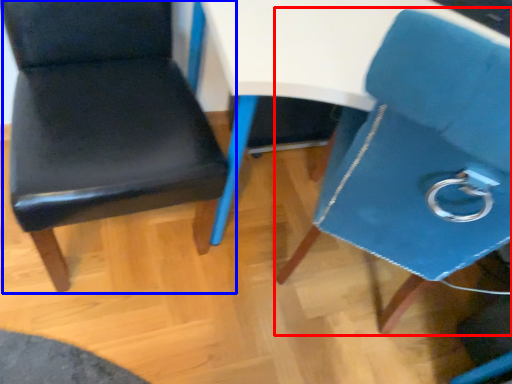
Question: Which of the following is the closest to the observer, chair (highlighted by a red box) or chair (highlighted by a blue box)?

Choices:
 (A) chair
 (B) chair

Answer: (A)